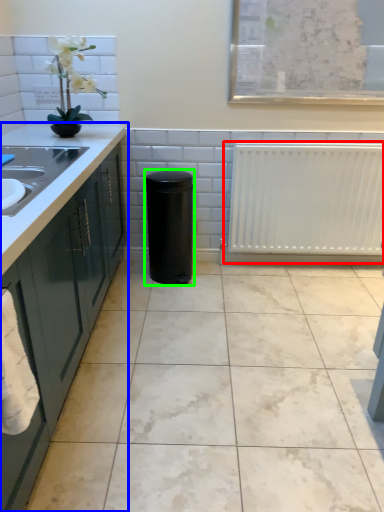
Question: Based on their relative distances, which object is farther from radiator (highlighted by a red box)? Choose from countertop (highlighted by a blue box) and appliance (highlighted by a green box).

Choices:
 (A) countertop
 (B) appliance

Answer: (A)